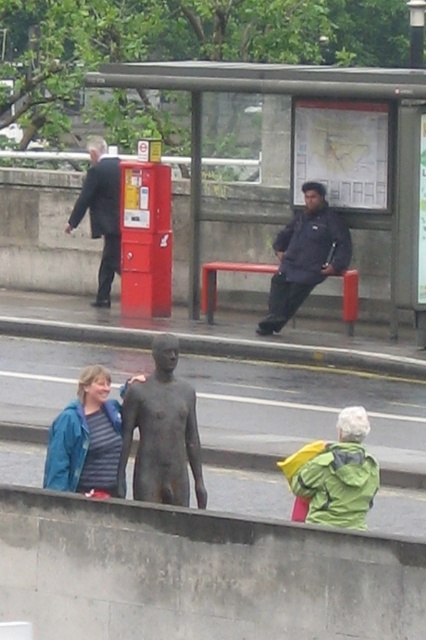
You are a photographer trying to capture both the matte blue jacket at lower left and the dark suit at left in the same frame. Based on their positions, which object should you adjust your camera angle to focus on first to ensure both are in the shot?

The matte blue jacket at lower left is to the right of the dark suit at left. To capture both in the same frame, adjust your camera angle to focus on the dark suit at left first since it is positioned further to the left, ensuring the matte blue jacket at lower left, which is to its right, remains within the frame.

You are standing at the bus stop and want to sit down. The metallic red bench at center is your only option. Based on the coordinates provided, can you reach the bench without crossing the concrete wall?

The metallic red bench at center is located at coordinates point [313,168], which is within the accessible area of the bus stop, so yes, you can reach it without crossing the concrete wall.